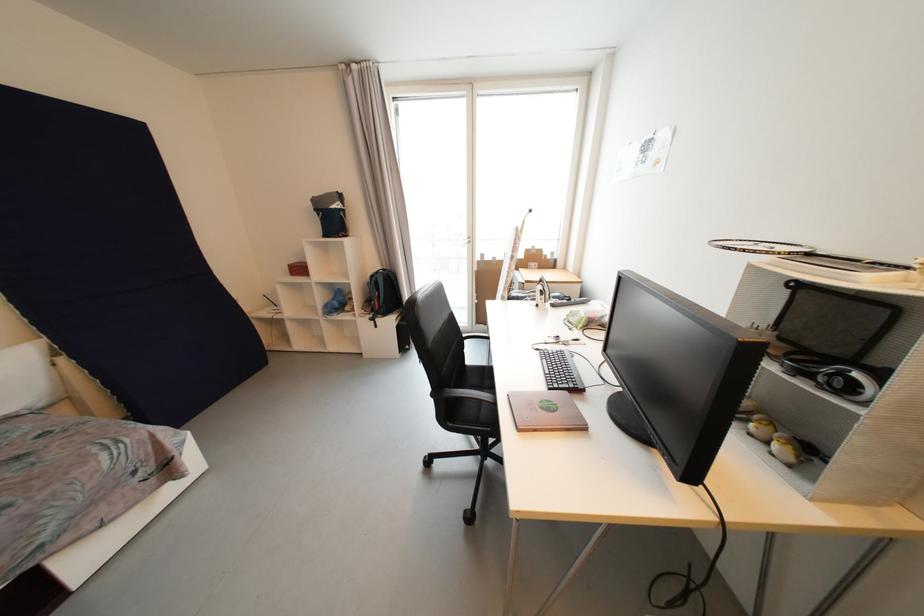
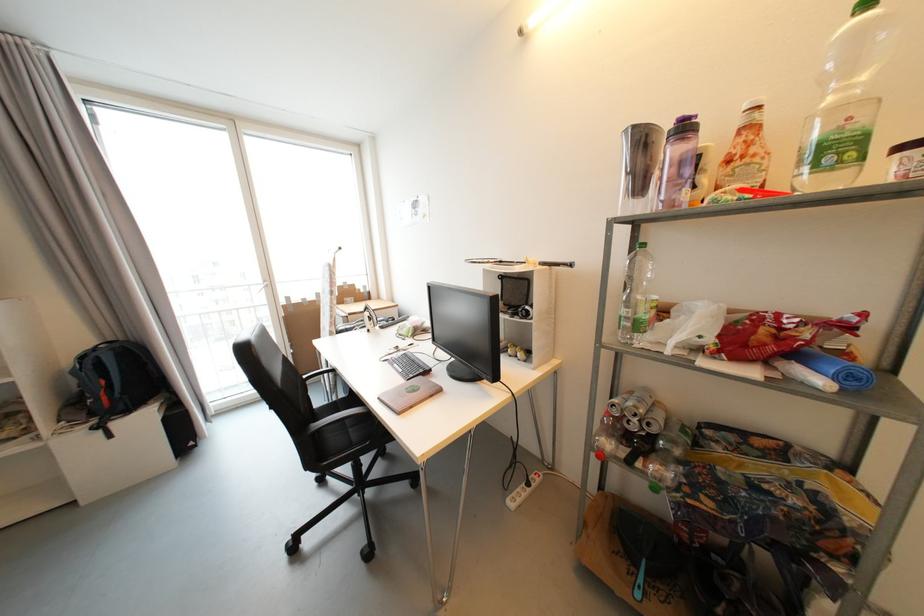
In the second image, find the point that corresponds to point 813,256 in the first image.

(505, 264)